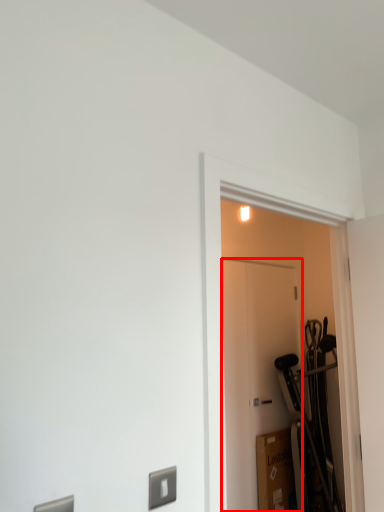
Question: From the image's perspective, where is door (annotated by the red box) located relative to door?

Choices:
 (A) below
 (B) above

Answer: (A)